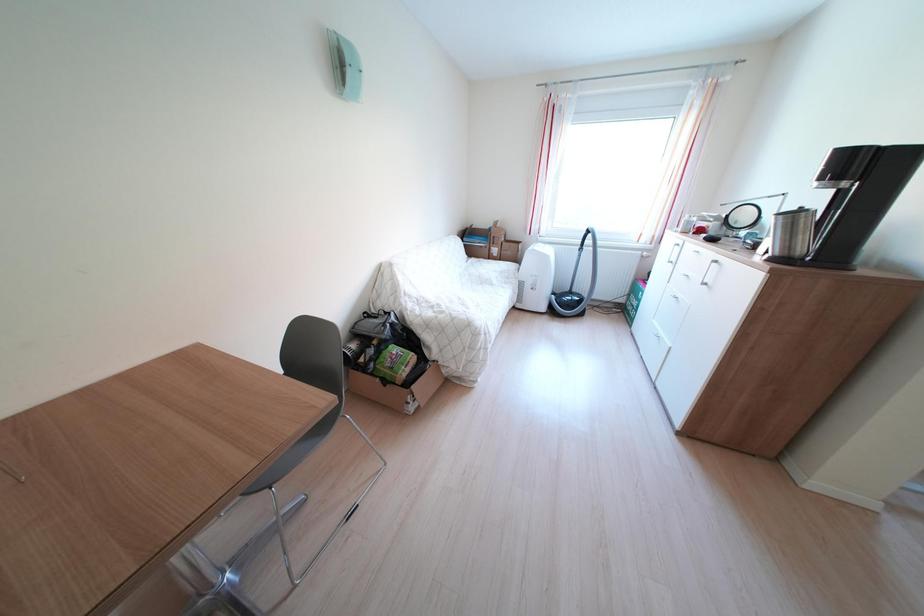
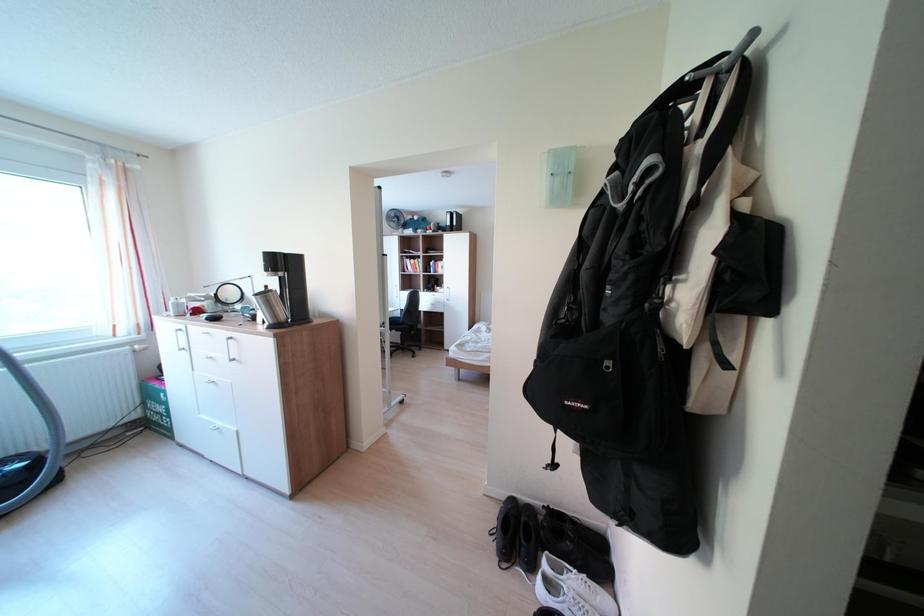
Question: Based on the continuous images, in which direction is the camera rotating? Reply with the corresponding letter.

Choices:
 (A) Left
 (B) Right
 (C) Up
 (D) Down

Answer: (B)